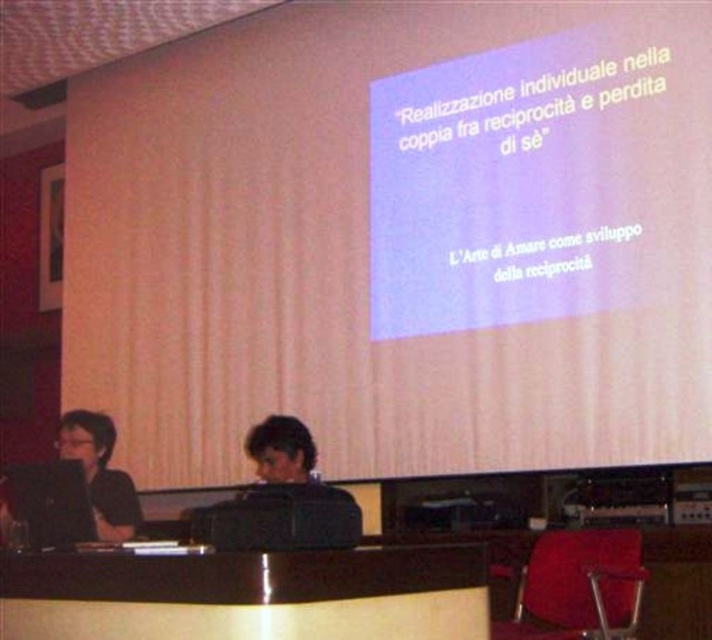
Is black glossy table at center bigger than velvet red chair at lower right?

No, black glossy table at center is not bigger than velvet red chair at lower right.

Is point (219, 588) closer to viewer compared to point (607, 547)?

That is True.

Identify the location of black glossy table at center. The image size is (712, 640). (248, 595).